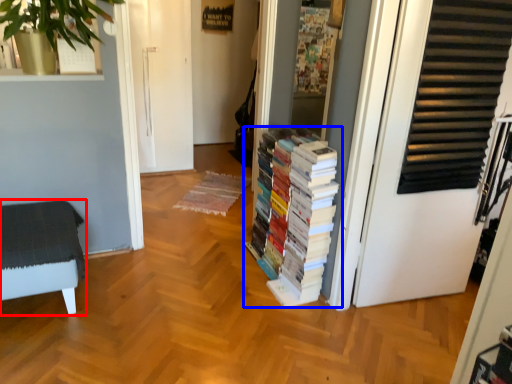
Question: Among these objects, which one is nearest to the camera, furniture (highlighted by a red box) or book (highlighted by a blue box)?

Choices:
 (A) furniture
 (B) book

Answer: (A)